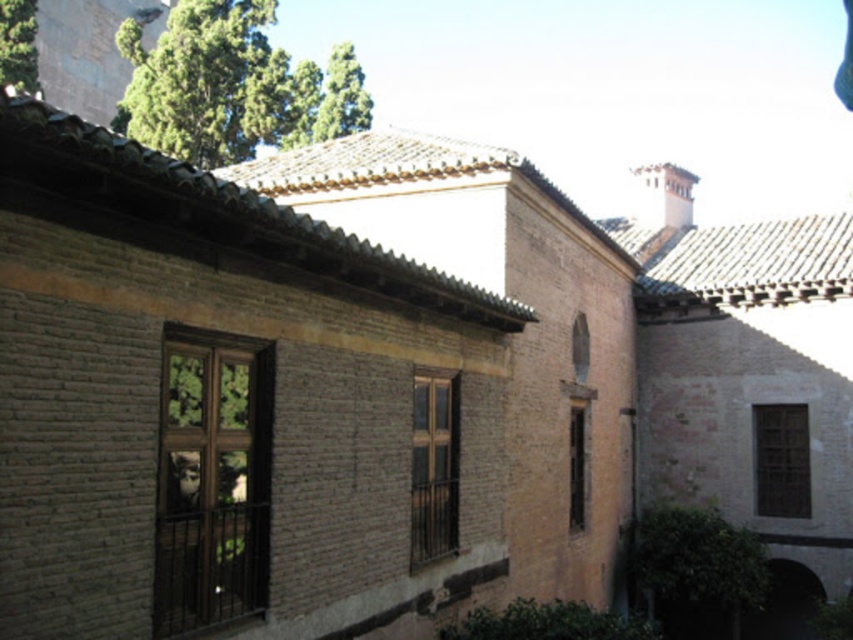
You are standing outside the traditional building and want to estimate how far the brown wooden window at lower right is from you. Based on the scene, can you determine the approximate distance?

The brown wooden window at lower right is approximately 22.57 meters away from the viewer.

You are standing at the entrance of the traditional building and see two points marked on the wall. Which point is closer to you, point (215, 602) or point (583, 404)?

Point (215, 602) is in front of point (583, 404), so it is closer to you.

You are standing in front of the building described in the scene. You need to reach the brown wooden window at center to retrieve something. Considering the distance provided, can you estimate how far you are from the window?

The brown wooden window at center is 26.13 feet away from the viewer, so you are approximately 26.13 feet away from the window.